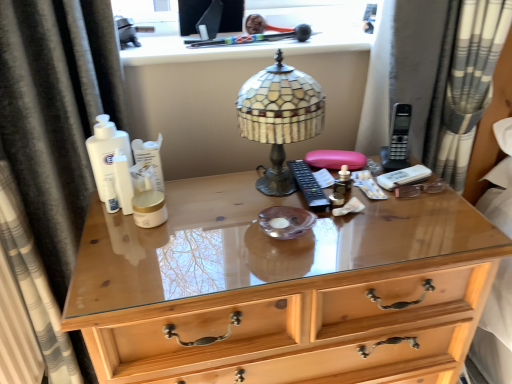
Question: Is gray striped curtain at right, which is counted as the first curtain, starting from the right, positioned behind white matte lotion at center, which ranks as the first toiletry in back-to-front order?

Choices:
 (A) no
 (B) yes

Answer: (B)

Question: From a real-world perspective, is gray striped curtain at right, which is counted as the first curtain, starting from the right, under white matte lotion at center, the second toiletry in the front-to-back sequence?

Choices:
 (A) no
 (B) yes

Answer: (A)

Question: Can you confirm if gray striped curtain at right, which appears as the 2th curtain when viewed from the left, is shorter than white matte lotion at center, the 1th toiletry when ordered from top to bottom?

Choices:
 (A) no
 (B) yes

Answer: (A)

Question: Can you confirm if gray striped curtain at right, which is counted as the first curtain, starting from the right, is thinner than white matte lotion at center, marked as the second toiletry in a bottom-to-top arrangement?

Choices:
 (A) no
 (B) yes

Answer: (A)

Question: Can we say gray striped curtain at right, which appears as the 2th curtain when viewed from the left, lies outside white matte lotion at center, the second toiletry in the front-to-back sequence?

Choices:
 (A) yes
 (B) no

Answer: (A)

Question: From a real-world perspective, does gray striped curtain at right, which appears as the 2th curtain when viewed from the left, stand above white matte lotion at center, which ranks as the first toiletry in back-to-front order?

Choices:
 (A) yes
 (B) no

Answer: (A)

Question: From the image's perspective, is stained glass lampshade at center over white matte lotion at center, the second toiletry in the front-to-back sequence?

Choices:
 (A) yes
 (B) no

Answer: (A)

Question: Is stained glass lampshade at center located outside white matte lotion at center, marked as the second toiletry in a bottom-to-top arrangement?

Choices:
 (A) yes
 (B) no

Answer: (A)

Question: Is stained glass lampshade at center next to white matte lotion at center, the 1th toiletry when ordered from top to bottom?

Choices:
 (A) yes
 (B) no

Answer: (B)

Question: Considering the relative sizes of stained glass lampshade at center and white matte lotion at center, which ranks as the first toiletry in back-to-front order, in the image provided, is stained glass lampshade at center thinner than white matte lotion at center, which ranks as the first toiletry in back-to-front order,?

Choices:
 (A) yes
 (B) no

Answer: (B)

Question: Could you tell me if stained glass lampshade at center is turned towards white matte lotion at center, the second toiletry in the front-to-back sequence?

Choices:
 (A) no
 (B) yes

Answer: (A)

Question: Does stained glass lampshade at center come behind white matte lotion at center, the 1th toiletry when ordered from top to bottom?

Choices:
 (A) no
 (B) yes

Answer: (A)

Question: Considering the relative sizes of black fabric curtain at left, which appears as the first curtain when viewed from the left, and wooden chest of drawers at center in the image provided, is black fabric curtain at left, which appears as the first curtain when viewed from the left, shorter than wooden chest of drawers at center?

Choices:
 (A) yes
 (B) no

Answer: (B)